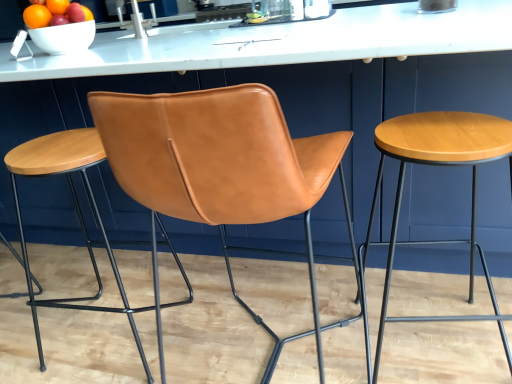
Question: Considering the relative sizes of wooden stool at right, arranged as the 2th stool when viewed from the left, and cognac leather chair at center in the image provided, is wooden stool at right, arranged as the 2th stool when viewed from the left, bigger than cognac leather chair at center?

Choices:
 (A) yes
 (B) no

Answer: (B)

Question: Does wooden stool at right, the 1th stool from the right, lie behind cognac leather chair at center?

Choices:
 (A) yes
 (B) no

Answer: (A)

Question: Is wooden stool at right, the 1th stool from the right, taller than cognac leather chair at center?

Choices:
 (A) no
 (B) yes

Answer: (A)

Question: Is cognac leather chair at center inside wooden stool at right, arranged as the 2th stool when viewed from the left?

Choices:
 (A) yes
 (B) no

Answer: (B)

Question: From the image's perspective, is wooden stool at right, the 1th stool from the right, under cognac leather chair at center?

Choices:
 (A) no
 (B) yes

Answer: (B)

Question: Considering the positions of point (98, 294) and point (44, 11), is point (98, 294) closer or farther from the camera than point (44, 11)?

Choices:
 (A) closer
 (B) farther

Answer: (A)

Question: From a real-world perspective, is saddle brown leather stool at center, which ranks as the second stool in right-to-left order, positioned above or below shiny ceramic bowl at upper left?

Choices:
 (A) above
 (B) below

Answer: (B)

Question: From the image's perspective, is saddle brown leather stool at center, which ranks as the second stool in right-to-left order, located above or below shiny ceramic bowl at upper left?

Choices:
 (A) above
 (B) below

Answer: (B)

Question: From their relative heights in the image, would you say saddle brown leather stool at center, which is the 1th stool in left-to-right order, is taller or shorter than shiny ceramic bowl at upper left?

Choices:
 (A) tall
 (B) short

Answer: (A)

Question: Considering their positions, is saddle brown leather stool at center, which ranks as the second stool in right-to-left order, located in front of or behind wooden stool at right, the 1th stool from the right?

Choices:
 (A) behind
 (B) front

Answer: (A)

Question: Is saddle brown leather stool at center, which is the 1th stool in left-to-right order, wider or thinner than wooden stool at right, the 1th stool from the right?

Choices:
 (A) wide
 (B) thin

Answer: (A)

Question: From a real-world perspective, is saddle brown leather stool at center, which is the 1th stool in left-to-right order, physically located above or below wooden stool at right, the 1th stool from the right?

Choices:
 (A) below
 (B) above

Answer: (B)

Question: Does point (15, 192) appear closer or farther from the camera than point (385, 301)?

Choices:
 (A) farther
 (B) closer

Answer: (A)

Question: From a real-world perspective, is white glossy bowl at upper left physically located above or below wooden stool at right, the 1th stool from the right?

Choices:
 (A) below
 (B) above

Answer: (B)

Question: Is white glossy bowl at upper left inside or outside of wooden stool at right, arranged as the 2th stool when viewed from the left?

Choices:
 (A) inside
 (B) outside

Answer: (B)